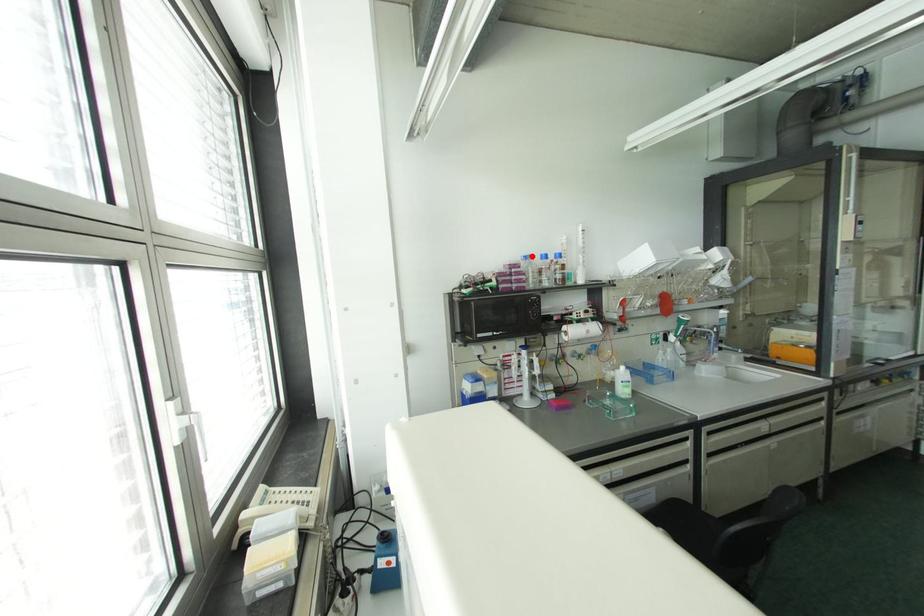
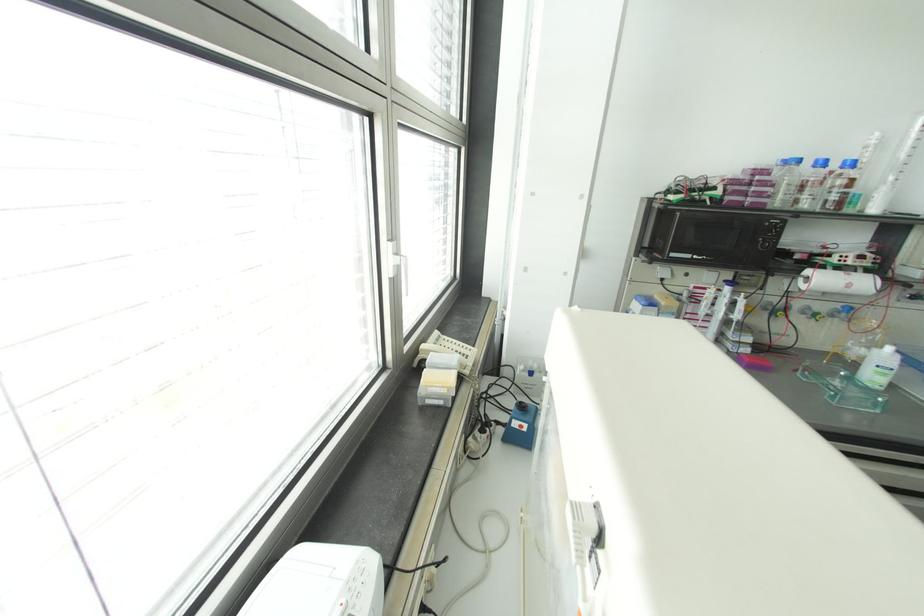
Locate, in the second image, the point that corresponds to the highlighted location in the first image.

(797, 160)